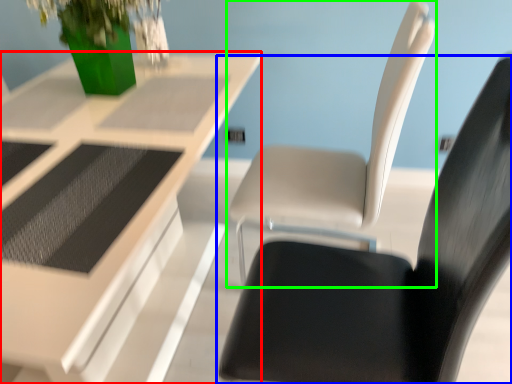
Question: Which is farther away from table (highlighted by a red box)? chair (highlighted by a blue box) or chair (highlighted by a green box)?

Choices:
 (A) chair
 (B) chair

Answer: (A)